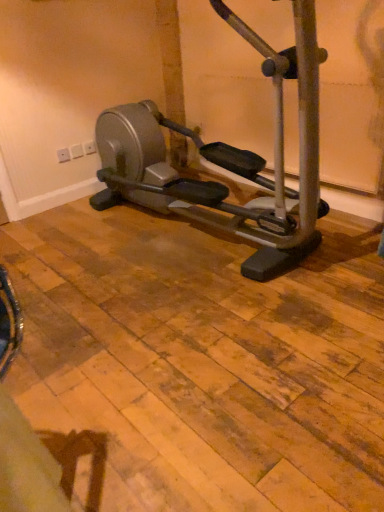
Image resolution: width=384 pixels, height=512 pixels. Identify the location of free location in front of silver metallic stationary bicycle at center. (228, 360).